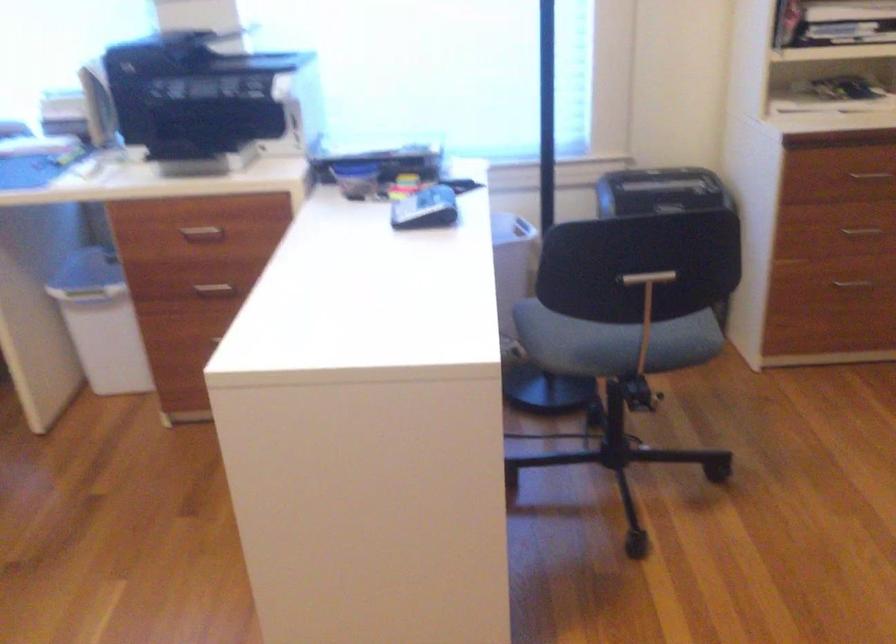
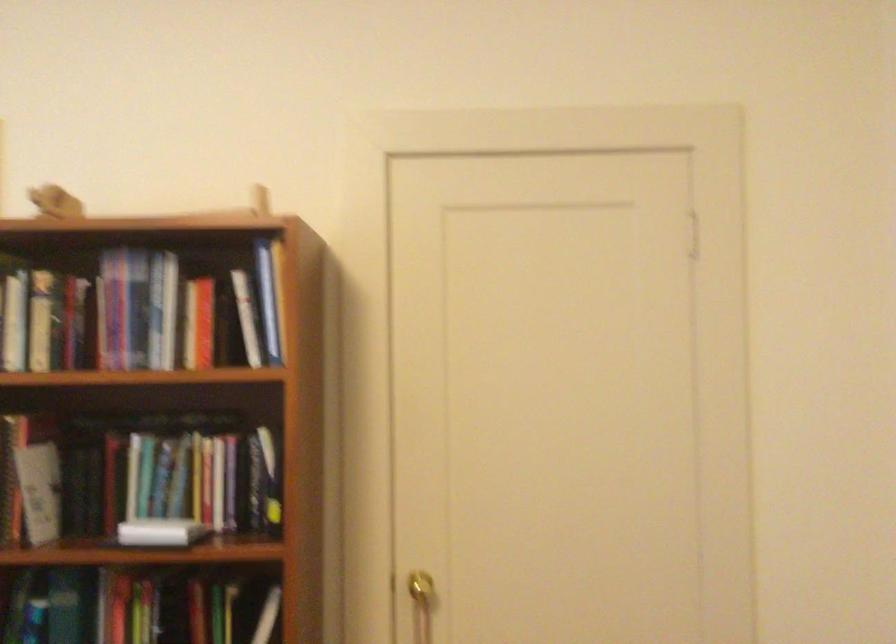
Question: The camera is either moving clockwise (left) or counter-clockwise (right) around the object. The first image is from the beginning of the video and the second image is from the end. Is the camera moving left or right when shooting the video?

Choices:
 (A) Left
 (B) Right

Answer: (A)